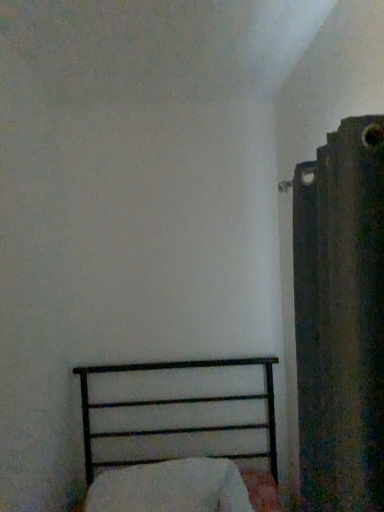
Question: Is white soft pillow at lower center behind dark textured fabric at right?

Choices:
 (A) yes
 (B) no

Answer: (A)

Question: Is white soft pillow at lower center oriented away from dark textured fabric at right?

Choices:
 (A) yes
 (B) no

Answer: (B)

Question: Does white soft pillow at lower center have a greater width compared to dark textured fabric at right?

Choices:
 (A) yes
 (B) no

Answer: (A)

Question: Is dark textured fabric at right a part of white soft pillow at lower center?

Choices:
 (A) yes
 (B) no

Answer: (B)

Question: Is white soft pillow at lower center shorter than dark textured fabric at right?

Choices:
 (A) no
 (B) yes

Answer: (B)

Question: Is white soft pillow at lower center in front of or behind black metal bed at lower left in the image?

Choices:
 (A) front
 (B) behind

Answer: (B)

Question: From a real-world perspective, is white soft pillow at lower center positioned above or below black metal bed at lower left?

Choices:
 (A) above
 (B) below

Answer: (B)

Question: In terms of width, does white soft pillow at lower center look wider or thinner when compared to black metal bed at lower left?

Choices:
 (A) thin
 (B) wide

Answer: (A)

Question: From their relative heights in the image, would you say white soft pillow at lower center is taller or shorter than black metal bed at lower left?

Choices:
 (A) tall
 (B) short

Answer: (B)

Question: From a real-world perspective, is black metal bed at lower left positioned above or below white soft pillow at lower center?

Choices:
 (A) above
 (B) below

Answer: (A)

Question: In terms of size, does black metal bed at lower left appear bigger or smaller than white soft pillow at lower center?

Choices:
 (A) big
 (B) small

Answer: (A)

Question: Is point (92, 462) positioned closer to the camera than point (193, 478)?

Choices:
 (A) farther
 (B) closer

Answer: (A)

Question: Looking at their shapes, would you say black metal bed at lower left is wider or thinner than white soft pillow at lower center?

Choices:
 (A) thin
 (B) wide

Answer: (B)

Question: Considering the positions of dark textured fabric at right and white soft pillow at lower center in the image, is dark textured fabric at right taller or shorter than white soft pillow at lower center?

Choices:
 (A) tall
 (B) short

Answer: (A)

Question: Is dark textured fabric at right inside or outside of white soft pillow at lower center?

Choices:
 (A) outside
 (B) inside

Answer: (A)